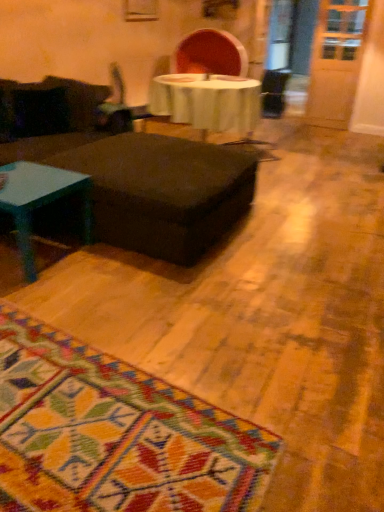
Question: Is point (115, 120) positioned closer to the camera than point (233, 158)?

Choices:
 (A) farther
 (B) closer

Answer: (A)

Question: Would you say metallic silver swivel chair at center is inside or outside matte black ottoman at center?

Choices:
 (A) inside
 (B) outside

Answer: (B)

Question: Considering the real-world distances, which object is closest to the matte black ottoman at center?

Choices:
 (A) teal glossy coffee table at left
 (B) metallic silver swivel chair at center

Answer: (A)

Question: Which object is positioned farthest from the matte black ottoman at center?

Choices:
 (A) metallic silver swivel chair at center
 (B) teal glossy coffee table at left

Answer: (A)